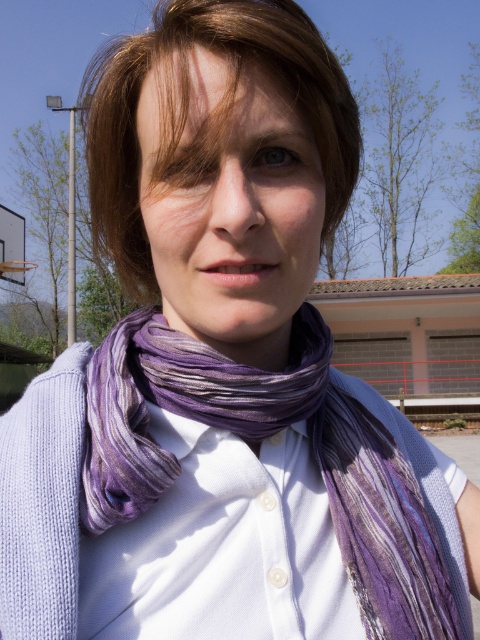
Question: Does purple silk scarf at center appear under brownsmoothhair at center?

Choices:
 (A) no
 (B) yes

Answer: (B)

Question: Which object appears closest to the camera in this image?

Choices:
 (A) brownsmoothhair at center
 (B) purple striped scarf at center

Answer: (A)

Question: Can you confirm if purple silk scarf at center is positioned to the left of brownsmoothhair at center?

Choices:
 (A) no
 (B) yes

Answer: (A)

Question: Which of the following is the farthest from the observer?

Choices:
 (A) purple striped scarf at center
 (B) purple silk scarf at center
 (C) brownsmoothhair at center

Answer: (B)

Question: Does purple silk scarf at center have a lesser width compared to purple striped scarf at center?

Choices:
 (A) no
 (B) yes

Answer: (A)

Question: Among these points, which one is farthest from the camera?

Choices:
 (A) (120, 321)
 (B) (259, 340)

Answer: (A)